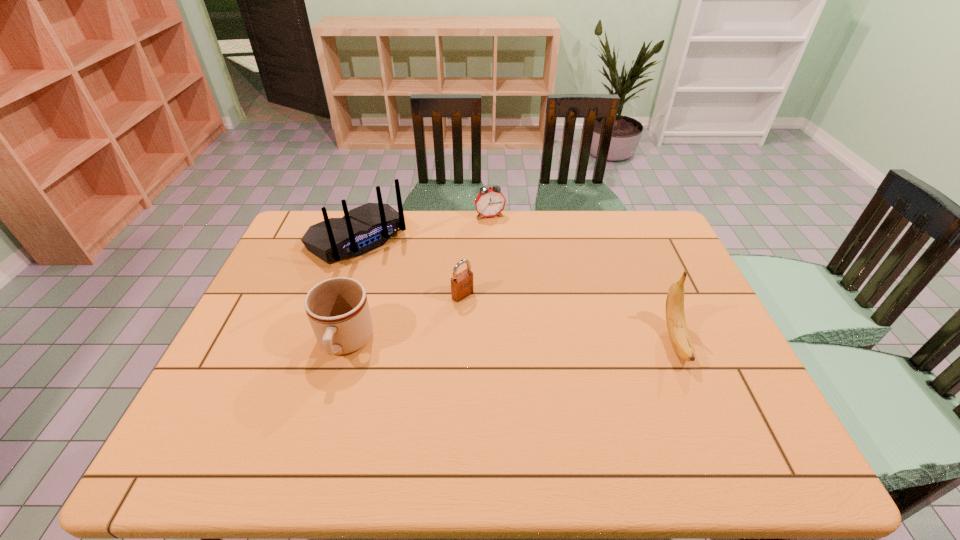
Identify the location of object present at the far left corner. The width and height of the screenshot is (960, 540). (367, 227).

Where is `vacant space at the far edge of the desktop`? This screenshot has height=540, width=960. vacant space at the far edge of the desktop is located at coordinates (541, 220).

Image resolution: width=960 pixels, height=540 pixels. Find the location of `vacant space at the near edge`. vacant space at the near edge is located at coordinates (485, 406).

Where is `vacant space at the left edge`? This screenshot has width=960, height=540. vacant space at the left edge is located at coordinates (247, 359).

Where is `free space at the right edge of the desktop`? The image size is (960, 540). free space at the right edge of the desktop is located at coordinates (668, 261).

You are a GUI agent. You are given a task and a screenshot of the screen. Output one action in this format:
    pyautogui.click(x=<x>, y=<y>)
    Task: Click on the vacant area at the near left corner
    Image resolution: width=960 pixels, height=540 pixels.
    Given the screenshot: What is the action you would take?
    pyautogui.click(x=241, y=394)

In the image, there is a desktop. Where is `vacant space at the far right corner`? Image resolution: width=960 pixels, height=540 pixels. vacant space at the far right corner is located at coordinates (636, 219).

Find the location of `unoccupied position between the padlock and the router`. unoccupied position between the padlock and the router is located at coordinates (410, 267).

The width and height of the screenshot is (960, 540). Identify the location of empty space that is in between the alarm clock and the rightmost object. (583, 279).

This screenshot has width=960, height=540. What are the coordinates of `free spot between the second tallest object and the mug` in the screenshot? It's located at (511, 342).